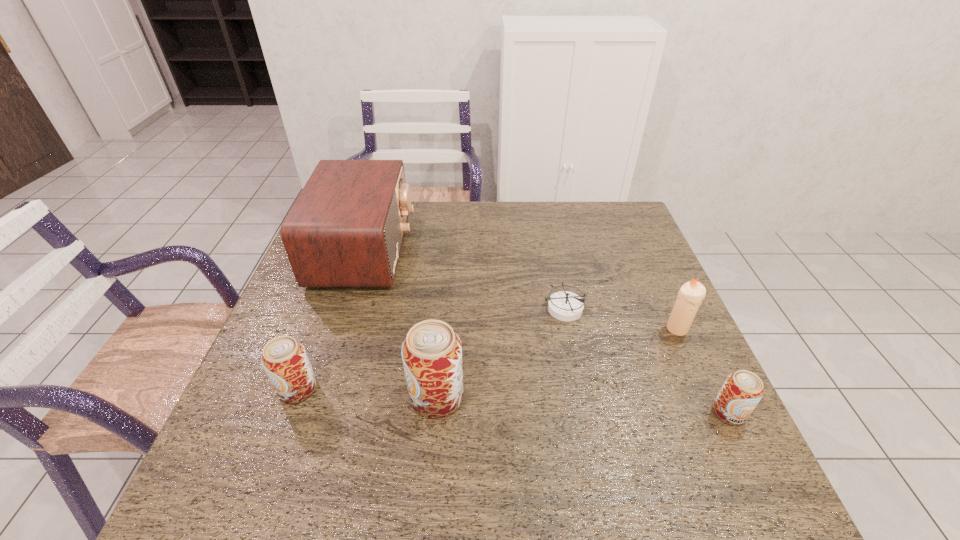
Please point a space for a new beer_can to maintain equal intervals. Please provide its 2D coordinates. Your answer should be formatted as a tuple, i.e. [(x, y)], where the tuple contains the x and y coordinates of a point satisfying the conditions above.

[(581, 404)]